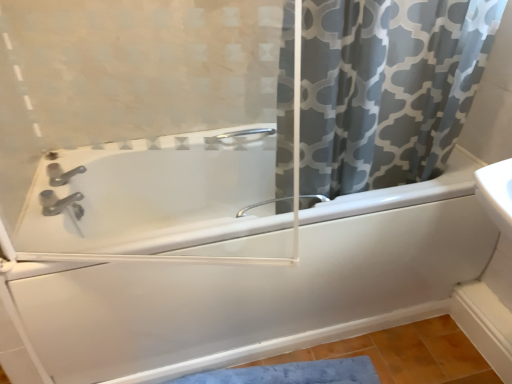
Question: Does transparent glass screen door at upper center lie behind satin nickel faucet at lower left?

Choices:
 (A) no
 (B) yes

Answer: (A)

Question: Does transparent glass screen door at upper center contain satin nickel faucet at lower left?

Choices:
 (A) no
 (B) yes

Answer: (A)

Question: Can you confirm if transparent glass screen door at upper center is taller than satin nickel faucet at lower left?

Choices:
 (A) yes
 (B) no

Answer: (A)

Question: Considering the relative sizes of transparent glass screen door at upper center and satin nickel faucet at lower left in the image provided, is transparent glass screen door at upper center bigger than satin nickel faucet at lower left?

Choices:
 (A) no
 (B) yes

Answer: (B)

Question: Is transparent glass screen door at upper center oriented towards satin nickel faucet at lower left?

Choices:
 (A) yes
 (B) no

Answer: (B)

Question: Is point (318, 198) closer or farther from the camera than point (48, 173)?

Choices:
 (A) closer
 (B) farther

Answer: (A)

Question: From the image's perspective, is satin nickel faucet at center positioned above or below satin nickel faucet at lower left?

Choices:
 (A) below
 (B) above

Answer: (A)

Question: Is satin nickel faucet at center bigger or smaller than satin nickel faucet at lower left?

Choices:
 (A) big
 (B) small

Answer: (B)

Question: In terms of width, does satin nickel faucet at center look wider or thinner when compared to satin nickel faucet at lower left?

Choices:
 (A) wide
 (B) thin

Answer: (B)

Question: Is satin nickel faucet at lower left taller or shorter than satin nickel faucet at center?

Choices:
 (A) tall
 (B) short

Answer: (A)

Question: In terms of width, does satin nickel faucet at lower left look wider or thinner when compared to satin nickel faucet at center?

Choices:
 (A) thin
 (B) wide

Answer: (B)

Question: Which is correct: satin nickel faucet at lower left is inside satin nickel faucet at center, or outside of it?

Choices:
 (A) outside
 (B) inside

Answer: (A)

Question: From the image's perspective, relative to satin nickel faucet at center, is satin nickel faucet at lower left above or below?

Choices:
 (A) below
 (B) above

Answer: (B)

Question: From the image's perspective, is white glossy bathtub at center above or below satin nickel faucet at center?

Choices:
 (A) below
 (B) above

Answer: (A)

Question: Considering the positions of white glossy bathtub at center and satin nickel faucet at center in the image, is white glossy bathtub at center taller or shorter than satin nickel faucet at center?

Choices:
 (A) tall
 (B) short

Answer: (A)